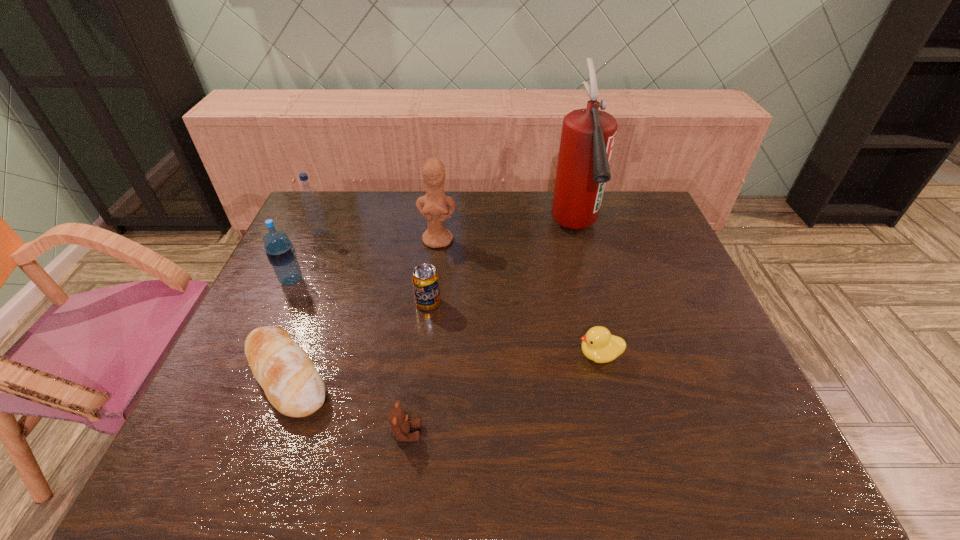
You are a GUI agent. You are given a task and a screenshot of the screen. Output one action in this format:
    pyautogui.click(x=<x>, y=<y>)
    Task: Click on the vacant space at the near left corner of the desktop
    The width and height of the screenshot is (960, 540).
    Given the screenshot: What is the action you would take?
    pyautogui.click(x=213, y=446)

In the image, there is a desktop. Where is `vacant space at the far right corner`? vacant space at the far right corner is located at coordinates (654, 230).

Find the location of a particular element. free point between the fourth farthest object and the duckling is located at coordinates (445, 318).

Locate an element on the screen. free space that is in between the fourth nearest object and the farther water bottle is located at coordinates (374, 268).

At what (x,y) coordinates should I click in order to perform the action: click on free spot between the teddy bear and the farther water bottle. Please return your answer as a coordinate pair (x, y). Looking at the image, I should click on [x=363, y=333].

Locate an element on the screen. The image size is (960, 540). vacant space in between the nearer water bottle and the teddy bear is located at coordinates tap(348, 356).

This screenshot has width=960, height=540. What are the coordinates of `vacant point located between the farther water bottle and the duckling` in the screenshot? It's located at (460, 294).

This screenshot has height=540, width=960. What are the coordinates of `free space between the fire extinguisher and the seventh shortest object` in the screenshot? It's located at (507, 234).

Locate an element on the screen. This screenshot has width=960, height=540. free spot between the teddy bear and the figurine is located at coordinates (422, 336).

This screenshot has height=540, width=960. Identify the location of vacant area that lies between the bread and the teddy bear. (347, 404).